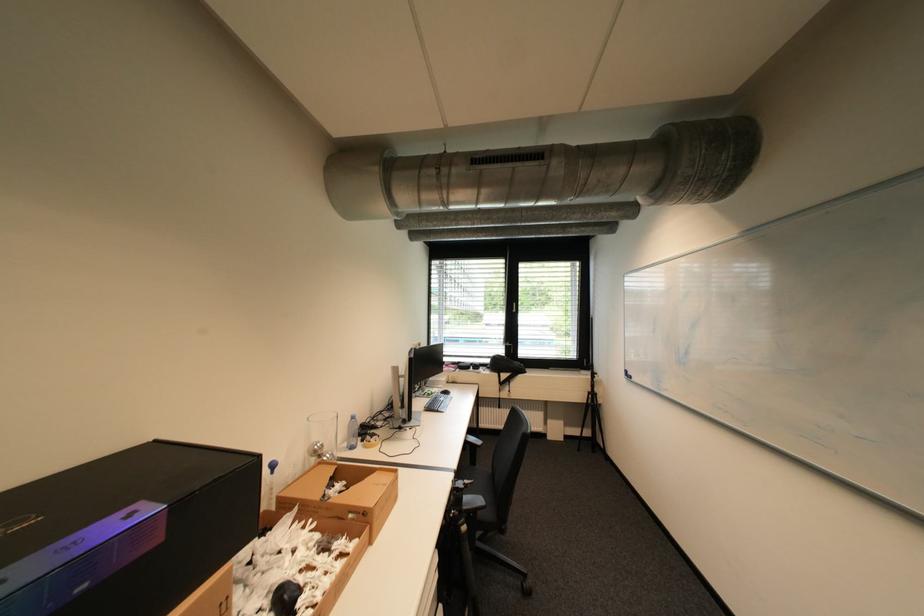
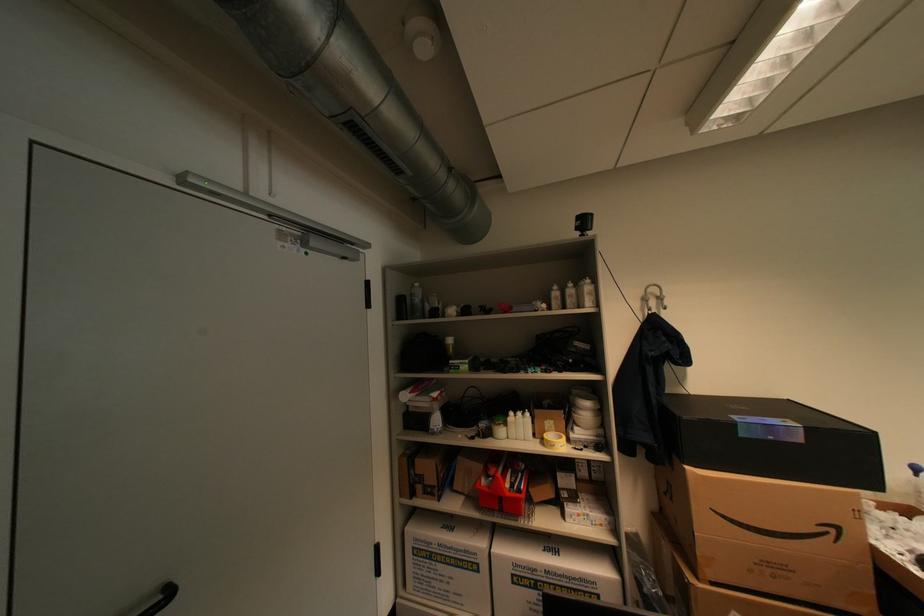
Locate, in the second image, the point that corresponds to point 164,541 in the first image.

(808, 440)